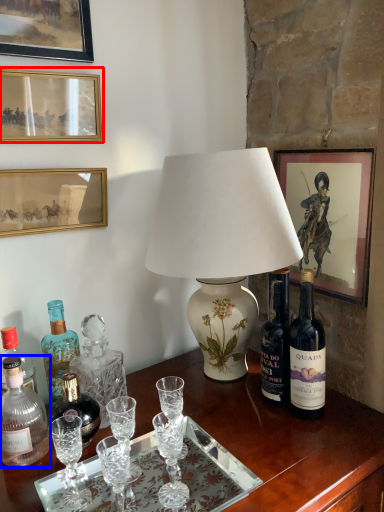
Question: Which point is closer to the camera, picture frame (highlighted by a red box) or bottle (highlighted by a blue box)?

Choices:
 (A) picture frame
 (B) bottle

Answer: (B)